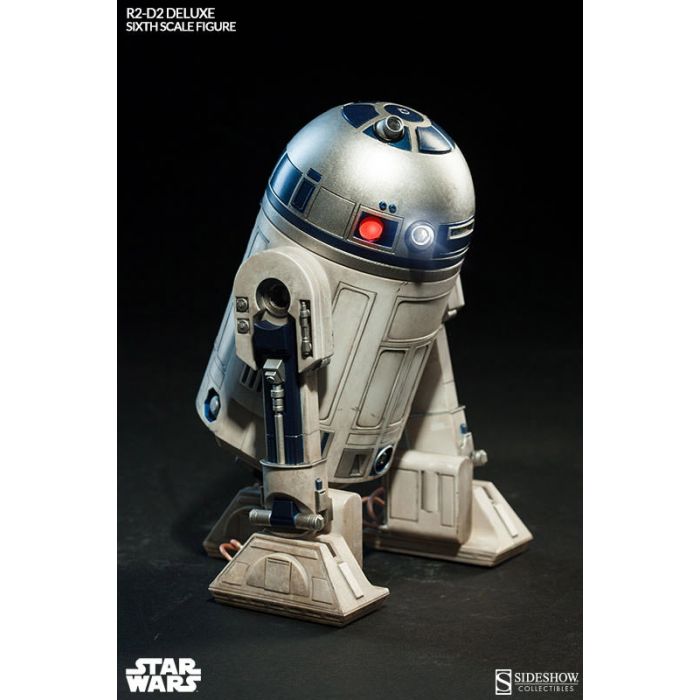
Where is `floor`? floor is located at coordinates (442, 656).